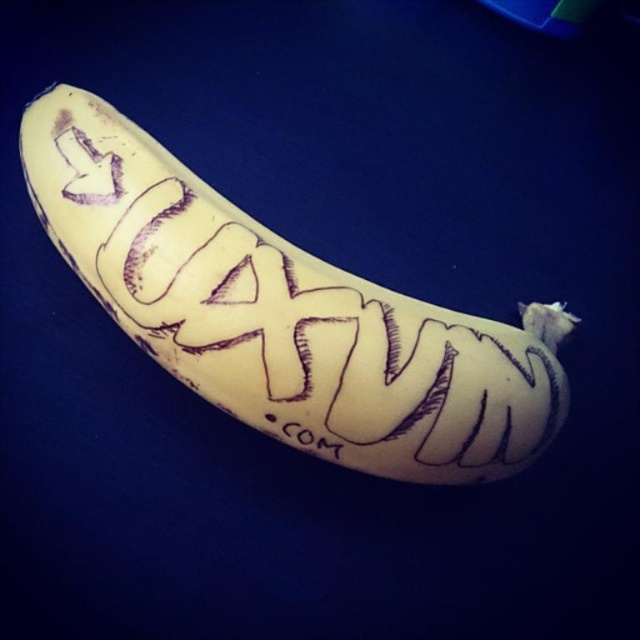
Question: Is yellow matte banana at center above black ink text at center?

Choices:
 (A) no
 (B) yes

Answer: (B)

Question: Which object is farther from the camera taking this photo?

Choices:
 (A) yellow matte banana at center
 (B) black ink text at center

Answer: (B)

Question: Is yellow matte banana at center below black ink text at center?

Choices:
 (A) yes
 (B) no

Answer: (B)

Question: Does yellow matte banana at center appear over black ink text at center?

Choices:
 (A) no
 (B) yes

Answer: (B)

Question: Which of the following is the closest to the observer?

Choices:
 (A) (333, 438)
 (B) (307, 445)

Answer: (A)